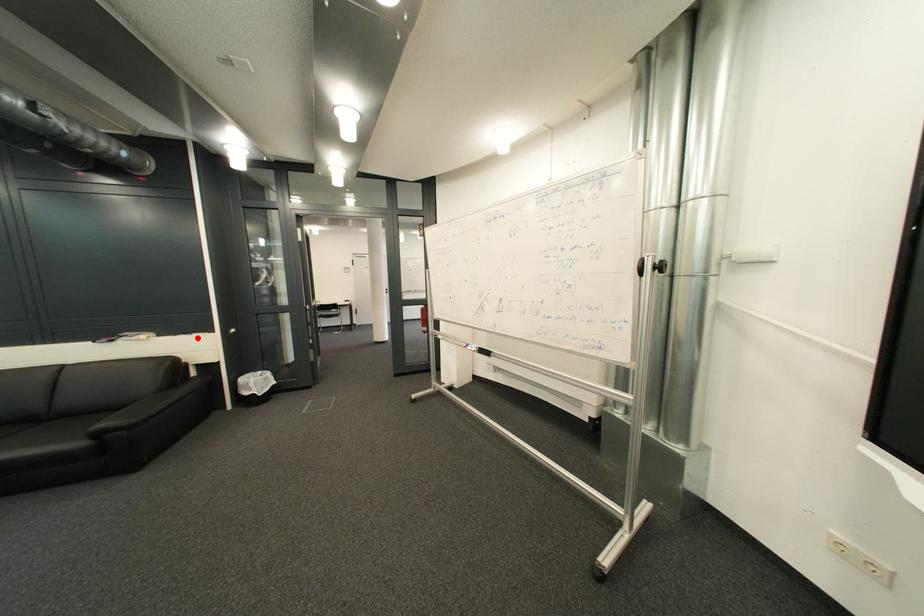
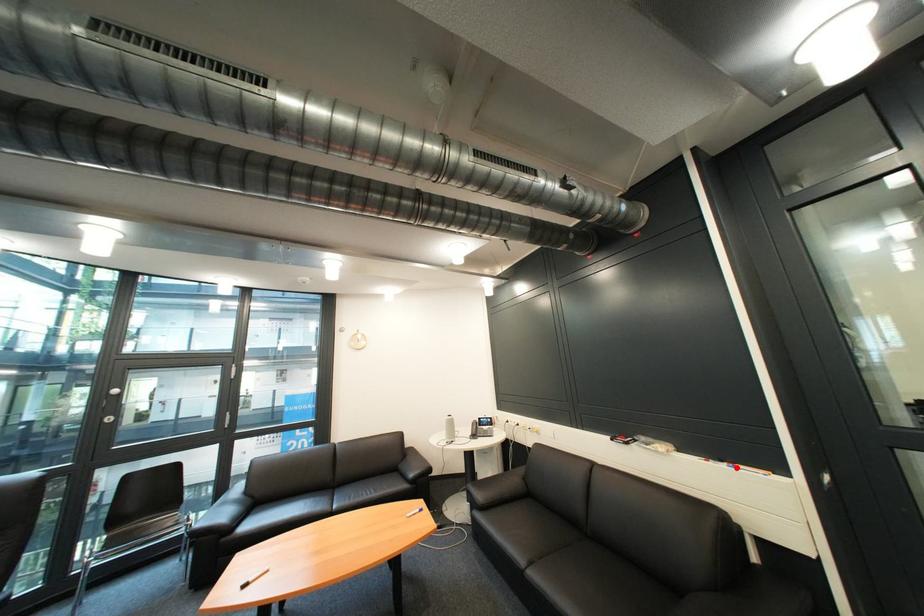
I am providing you with two images of the same scene from different viewpoints. A red point is marked on the first image and another point is marked on the second image. Does the point marked in image1 correspond to the same location as the one in image2?

Yes